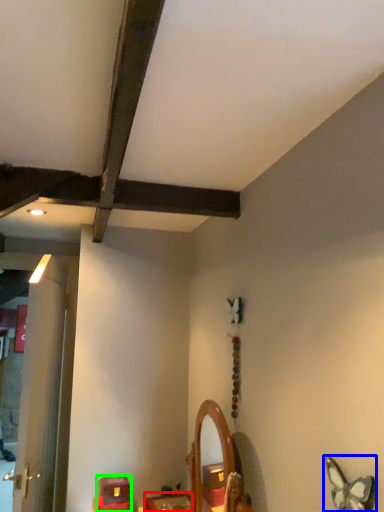
Question: Considering the real-world distances, which object is closest to furniture (highlighted by a red box)? butterfly (highlighted by a blue box) or furniture (highlighted by a green box).

Choices:
 (A) butterfly
 (B) furniture

Answer: (B)